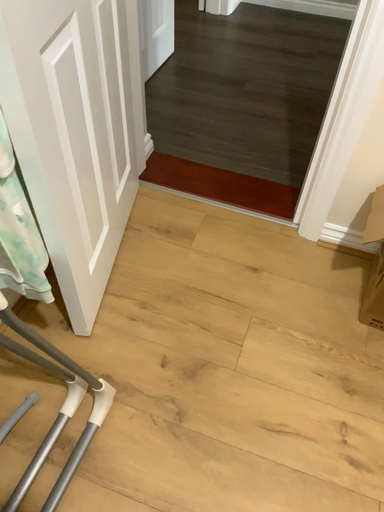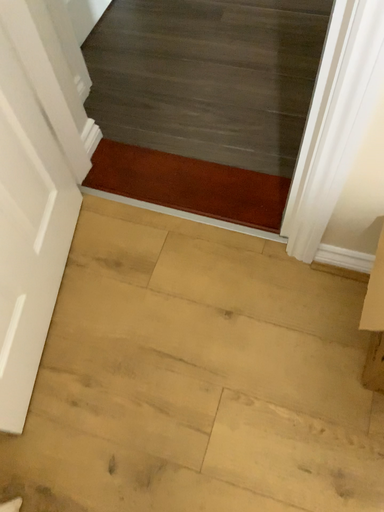
Question: How did the camera likely rotate when shooting the video?

Choices:
 (A) rotated downward
 (B) rotated upward

Answer: (A)